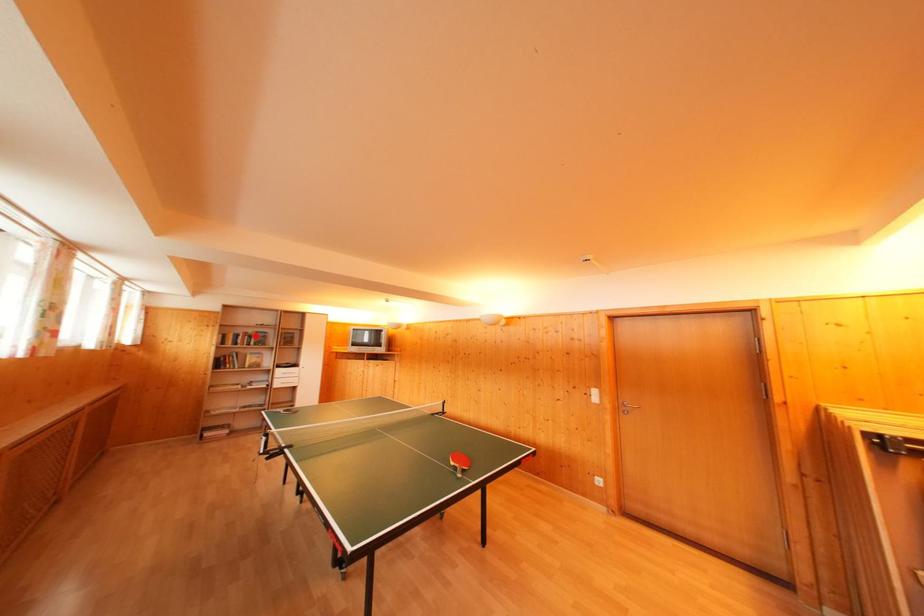
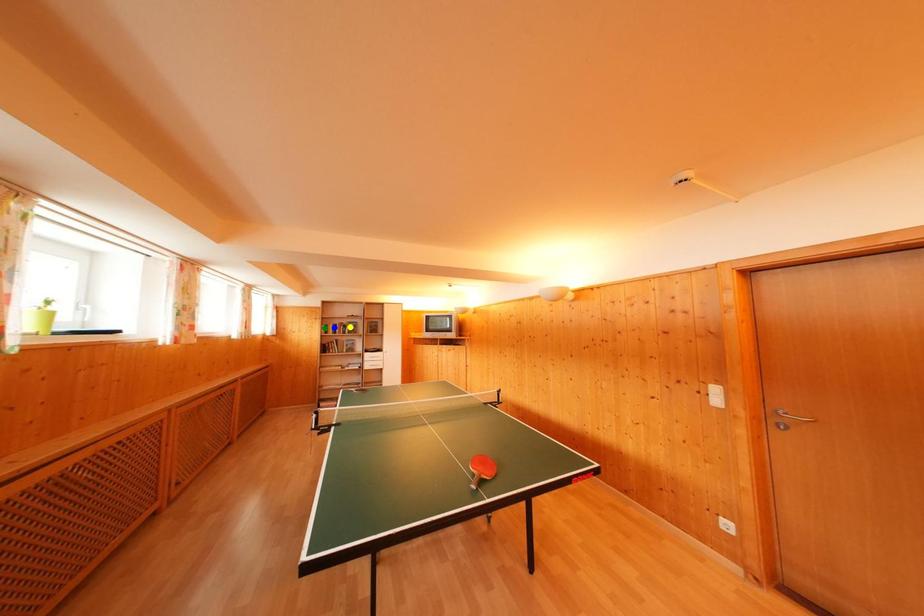
Question: I am providing you with two images of the same scene from different viewpoints. A red point is marked on the first image. You are given multiple points on the second image. Can you choose the point in image 2 that corresponds to the point in image 1?

Choices:
 (A) yellow point
 (B) green point
 (C) blue point

Answer: (A)